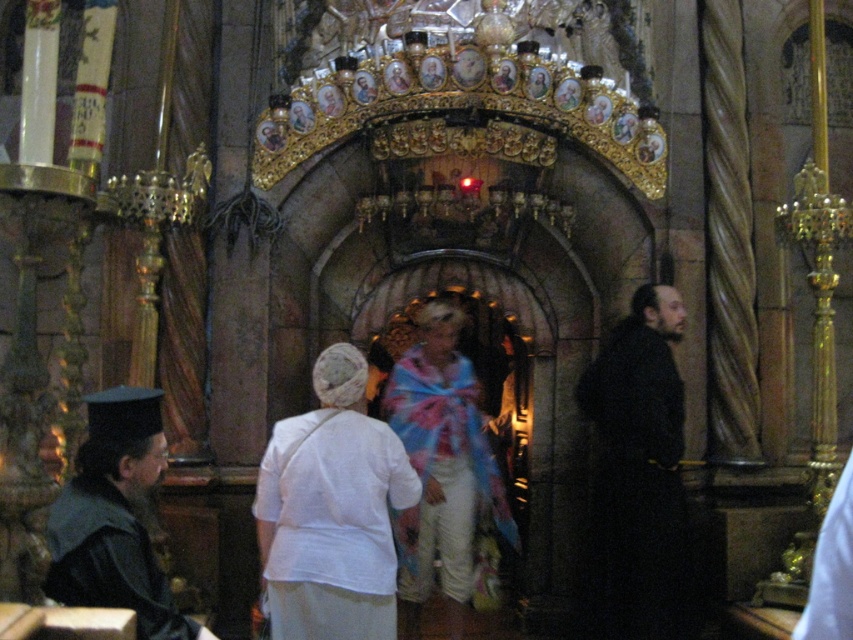
Between white fabric at center and black matte robe at right, which one has less height?

white fabric at center

Can you confirm if white fabric at center is positioned above black matte robe at right?

Indeed, white fabric at center is positioned over black matte robe at right.

Is point (312, 611) closer to camera compared to point (614, 422)?

Yes, point (312, 611) is in front of point (614, 422).

Identify the location of white fabric at center. Image resolution: width=853 pixels, height=640 pixels. (331, 512).

From the picture: Between white fabric at center and pastel floral scarf at center, which one has more height?

With more height is pastel floral scarf at center.

Between point (354, 451) and point (421, 314), which one is positioned in front?

Point (354, 451) is in front.

You are a GUI agent. You are given a task and a screenshot of the screen. Output one action in this format:
    pyautogui.click(x=<x>, y=<y>)
    Task: Click on the white fabric at center
    
    Given the screenshot: What is the action you would take?
    pyautogui.click(x=331, y=512)

Who is positioned more to the left, pastel floral scarf at center or black matte robe at left?

Positioned to the left is black matte robe at left.

Identify the location of pastel floral scarf at center. The image size is (853, 640). (440, 467).

You are a GUI agent. You are given a task and a screenshot of the screen. Output one action in this format:
    pyautogui.click(x=<x>, y=<y>)
    Task: Click on the pastel floral scarf at center
    
    Given the screenshot: What is the action you would take?
    pyautogui.click(x=440, y=467)